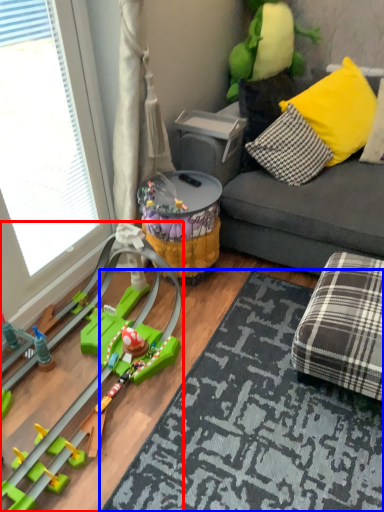
Question: Which object appears farthest to the camera in this image, toy (highlighted by a red box) or mat (highlighted by a blue box)?

Choices:
 (A) toy
 (B) mat

Answer: (B)